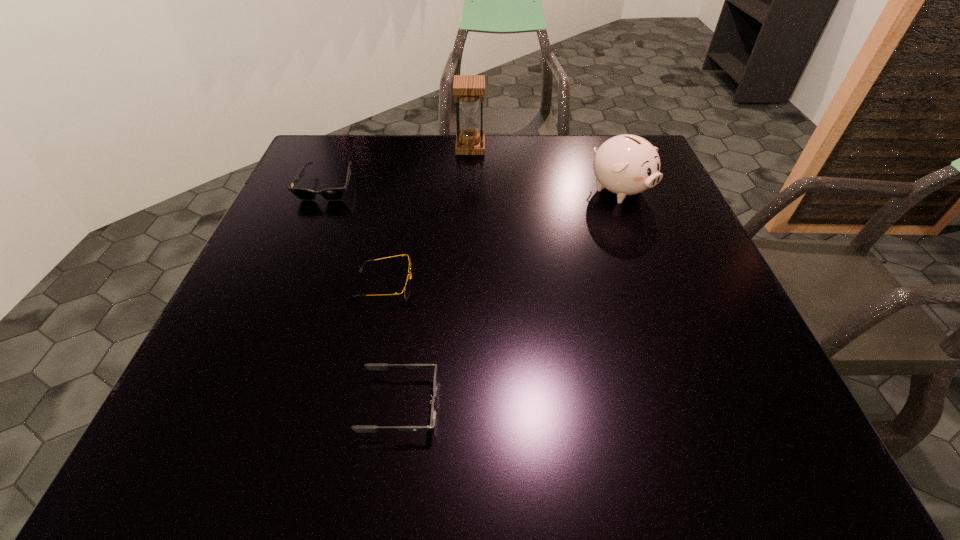
Identify the location of object at the far right corner. point(626,164).

Image resolution: width=960 pixels, height=540 pixels. I want to click on vacant area at the far edge, so (x=400, y=148).

In the image, there is a desktop. Where is `vacant area at the near edge`? The image size is (960, 540). vacant area at the near edge is located at coordinates (390, 454).

The image size is (960, 540). I want to click on free space at the left edge of the desktop, so click(324, 228).

This screenshot has height=540, width=960. In order to click on vacant area at the right edge in this screenshot , I will do `click(680, 295)`.

In the image, there is a desktop. Identify the location of vacant space at the far left corner. (349, 145).

Identify the location of empty space that is in between the second nearest object and the tallest object. The width and height of the screenshot is (960, 540). 427,217.

Locate an element on the screen. vacant space that's between the second nearest sunglasses and the leftmost object is located at coordinates (356, 236).

This screenshot has height=540, width=960. I want to click on vacant space in between the second nearest sunglasses and the piggy bank, so click(x=502, y=238).

At what (x,y) coordinates should I click in order to perform the action: click on free point between the nearest sunglasses and the farthest object. Please return your answer as a coordinate pair (x, y). This screenshot has width=960, height=540. Looking at the image, I should click on (435, 276).